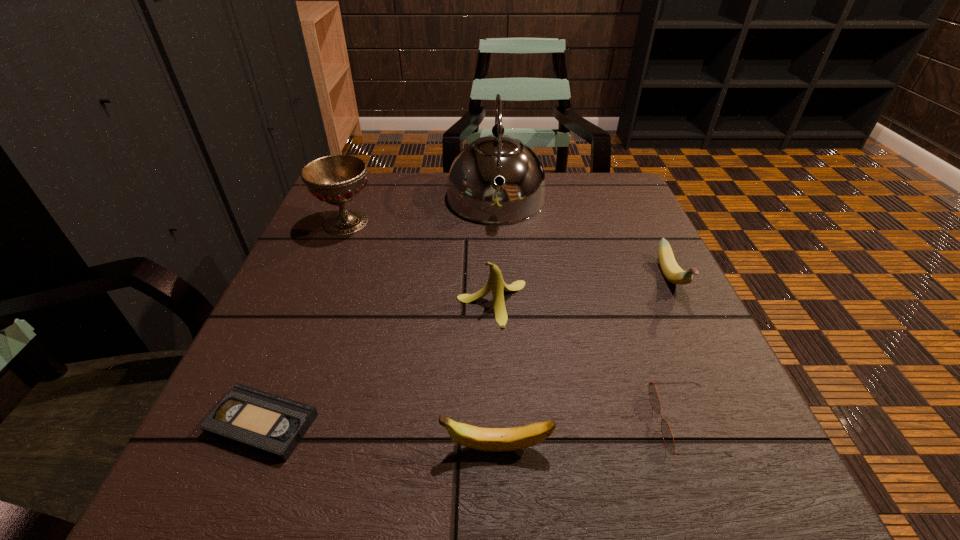
I want to click on free area in between the tallest banana and the nearest banana, so click(494, 375).

Where is `unoccupied area between the second tallest object and the kettle`? unoccupied area between the second tallest object and the kettle is located at coordinates (421, 211).

Where is `blank region between the second object from right to left and the sixth shortest object`? This screenshot has height=540, width=960. blank region between the second object from right to left and the sixth shortest object is located at coordinates (516, 323).

Find the location of `free spot between the third tallest object and the videotape`. free spot between the third tallest object and the videotape is located at coordinates (377, 363).

Identify the location of unoccupied area between the tallest banana and the chalice. (420, 263).

Where is `free area in between the tallest object and the rightmost object`? free area in between the tallest object and the rightmost object is located at coordinates (584, 239).

What are the coordinates of `unoccupied position between the kettle and the rightmost object` in the screenshot? It's located at (584, 239).

Locate which object ranks in proximity to the rightmost banana. Please provide its 2D coordinates. Your answer should be formatted as a tuple, i.e. [(x, y)], where the tuple contains the x and y coordinates of a point satisfying the conditions above.

[(667, 435)]

Identify the location of object that stands as the third closest to the nearest banana. (495, 283).

Locate which banana is the third closest to the sunglasses. Please provide its 2D coordinates. Your answer should be formatted as a tuple, i.e. [(x, y)], where the tuple contains the x and y coordinates of a point satisfying the conditions above.

[(495, 283)]